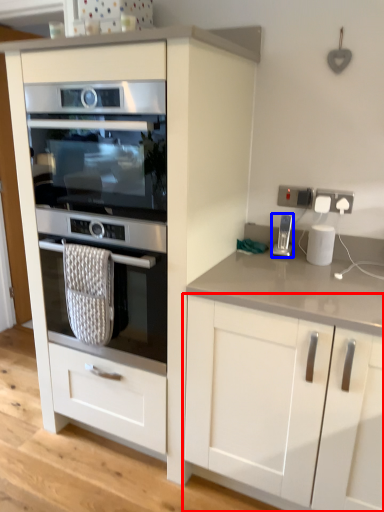
Question: Among these objects, which one is farthest to the camera, cabinetry (highlighted by a red box) or home appliance (highlighted by a blue box)?

Choices:
 (A) cabinetry
 (B) home appliance

Answer: (B)